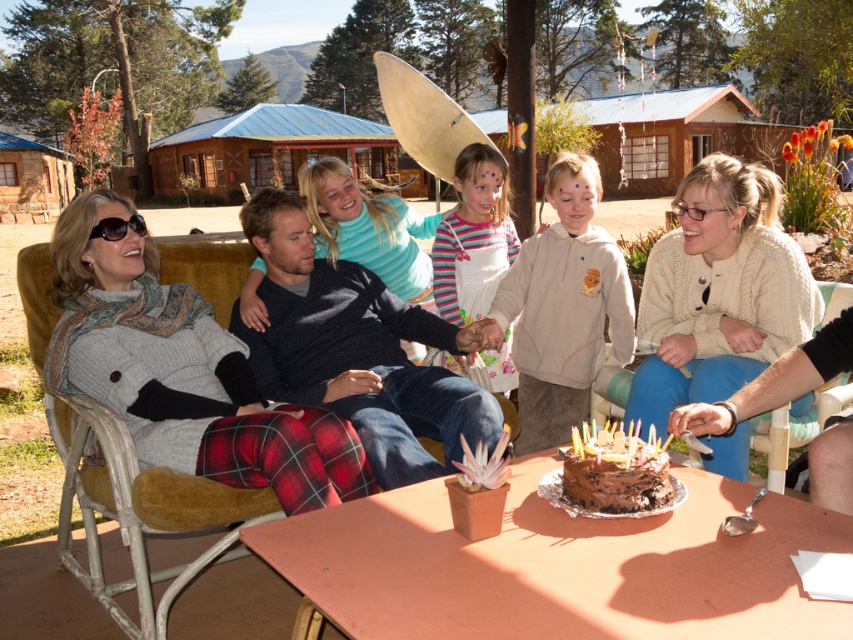
This screenshot has width=853, height=640. What do you see at coordinates (357, 349) in the screenshot?
I see `dark blue sweater at center` at bounding box center [357, 349].

Between point (381, 404) and point (666, 483), which one is positioned behind?

The point (381, 404) is more distant.

Identify the location of dark blue sweater at center. (357, 349).

Who is taller, plaid fabric pants at left or wooden chair at lower right?

plaid fabric pants at left

The height and width of the screenshot is (640, 853). Identify the location of plaid fabric pants at left. (183, 369).

The height and width of the screenshot is (640, 853). What are the coordinates of `plaid fabric pants at left` in the screenshot? It's located at (183, 369).

Does plaid fabric pants at left have a lesser width compared to light beige hoodie at center?

Incorrect, plaid fabric pants at left's width is not less than light beige hoodie at center's.

Is the position of plaid fabric pants at left more distant than that of light beige hoodie at center?

No, it is in front of light beige hoodie at center.

Which is behind, point (80, 368) or point (521, 266)?

The point (521, 266) is more distant.

I want to click on plaid fabric pants at left, so click(x=183, y=369).